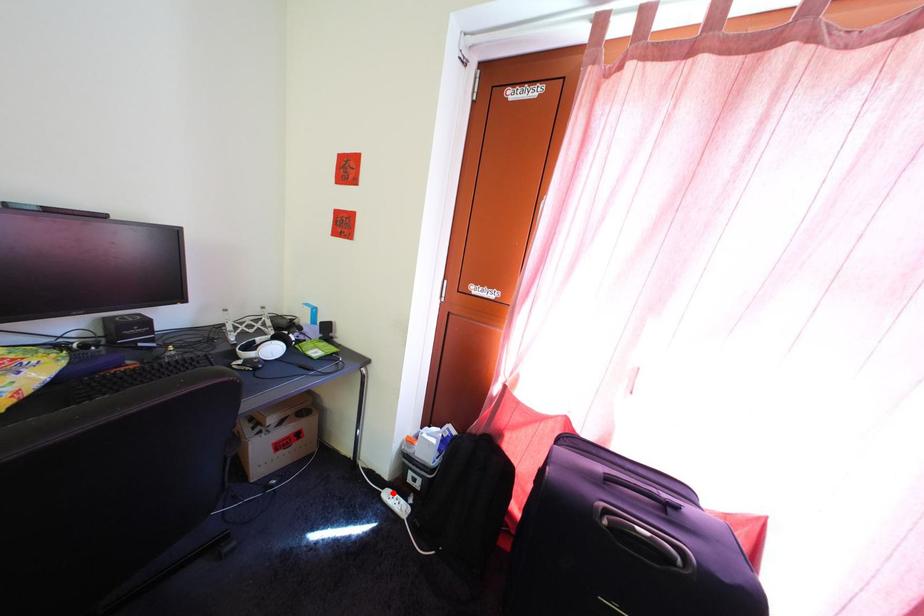
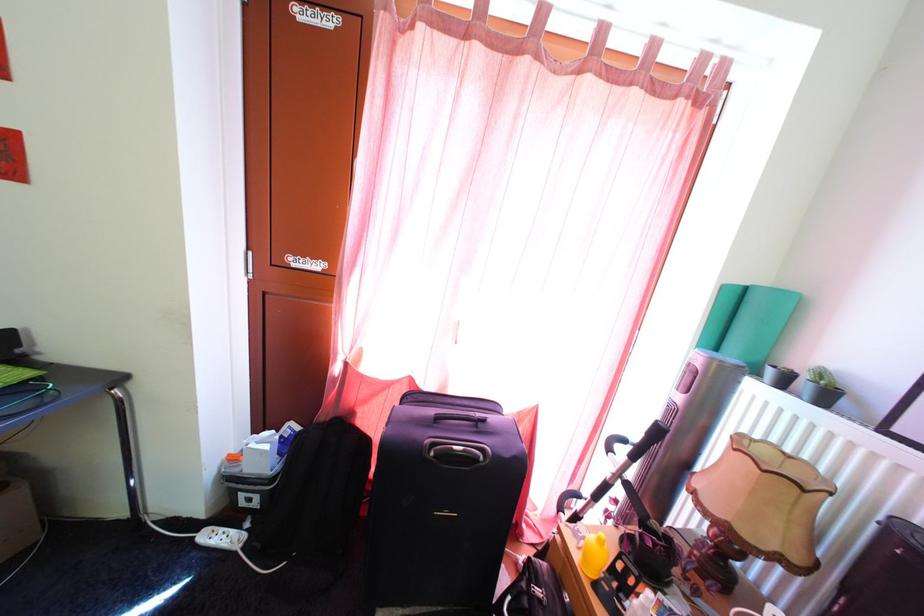
Question: I am providing you with two images of the same scene from different viewpoints. A red point is shown in image1. For the corresponding object point in image2, is it positioned nearer or farther from the camera?

Choices:
 (A) Nearer
 (B) Farther

Answer: (A)